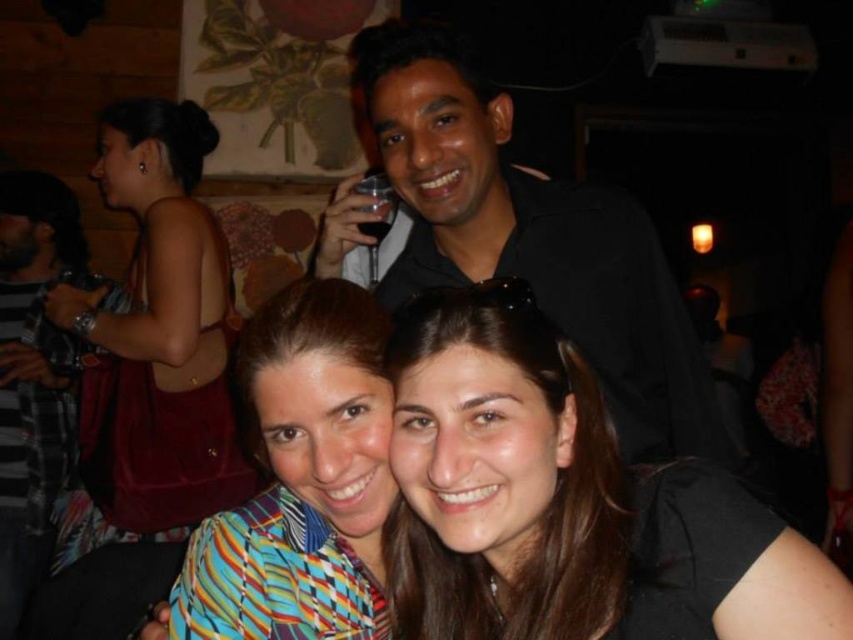
You are a photographer adjusting your camera settings to capture the scene. The black matte shirt at upper center and the transparent plastic wine glass at upper center are both in focus. If you want to ensure both remain in focus, what should the minimum depth of field be?

The minimum depth of field should be at least 8.67 inches to keep both the black matte shirt at upper center and the transparent plastic wine glass at upper center in focus.

You are standing in the bar and want to locate the black matte hair at center. According to the coordinates given, where should you look?

The black matte hair at center is located at point 0.784 on the x axis and 0.664 on the y axis.

You are a photographer standing at the camera position. You want to take a closeup shot of the black matte shirt at upper center. What is the minimum distance you need to move forward to focus on it?

The black matte shirt at upper center is 1.01 meters away from the camera. To focus on it for a closeup, you need to move forward until you are within the camera lens focusing range. However, since the current distance is already 1.01 meters, if the camera can focus at that distance, no movement is needed. Otherwise, adjust accordingly based on the lens specifications.